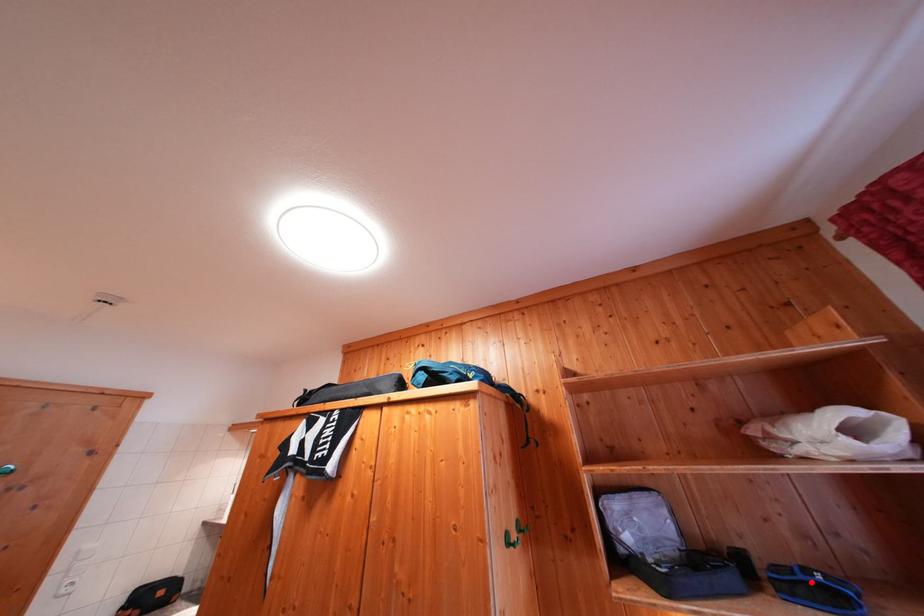
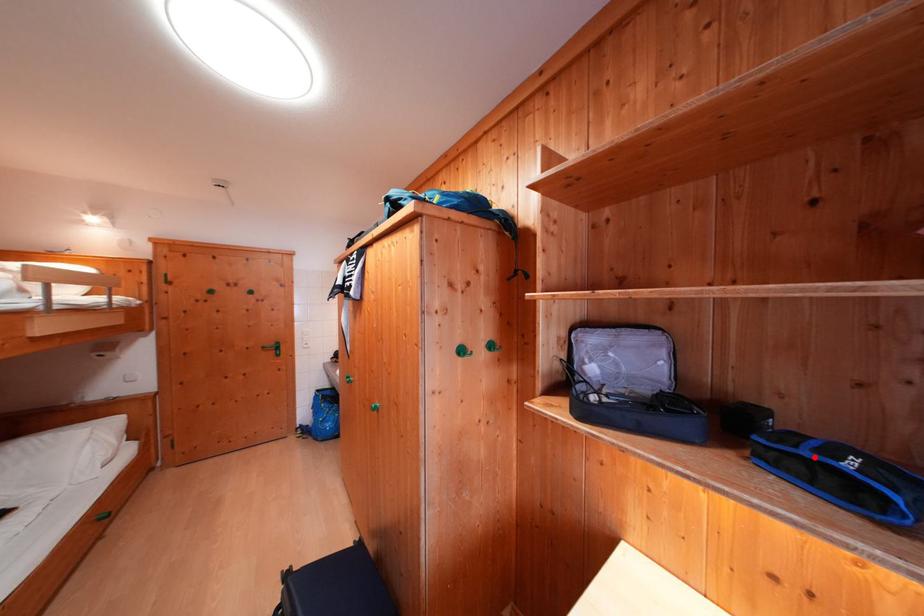
I am providing you with two images of the same scene from different viewpoints. A red point is marked on the first image and another point is marked on the second image. Do the highlighted points in image1 and image2 indicate the same real-world spot?

Yes